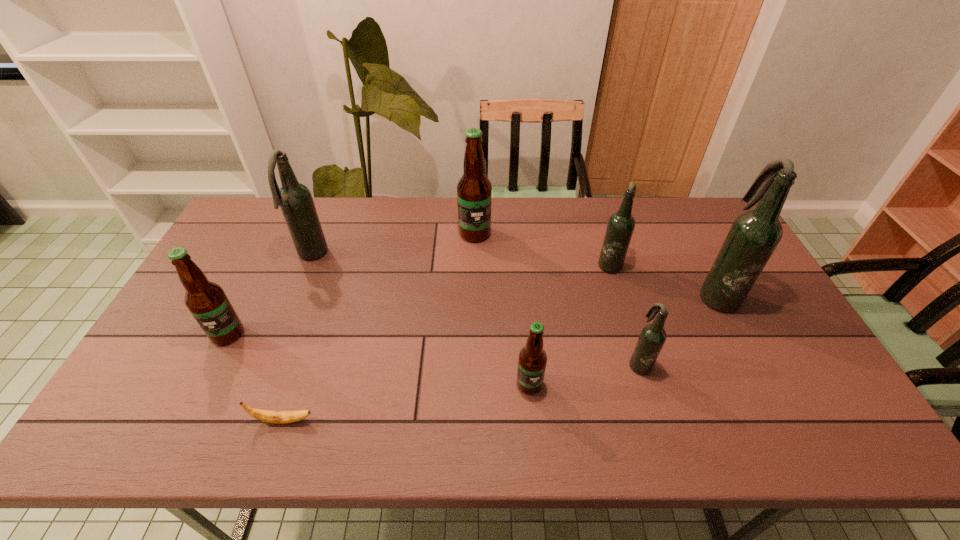
I want to click on the smallest brown beer bottle, so click(532, 360).

You are a GUI agent. You are given a task and a screenshot of the screen. Output one action in this format:
    pyautogui.click(x=<x>, y=<y>)
    Task: Click on the fifth object from left to right
    Image resolution: width=960 pixels, height=540 pixels.
    Given the screenshot: What is the action you would take?
    point(532,360)

This screenshot has width=960, height=540. I want to click on banana, so click(279, 417).

The height and width of the screenshot is (540, 960). In order to click on the nearest object in this screenshot , I will do `click(279, 417)`.

The image size is (960, 540). Find the location of `free space located 0.360m on the front of the rightmost object`. free space located 0.360m on the front of the rightmost object is located at coordinates (789, 436).

In order to click on free spot located on the left of the sixth beer bottle from right to left in this screenshot , I will do `click(273, 255)`.

Locate an element on the screen. The width and height of the screenshot is (960, 540). vacant space situated on the label of the fifth object from right to left is located at coordinates (474, 258).

Find the location of a particular element. The width and height of the screenshot is (960, 540). vacant space situated on the right of the third biggest dark beer bottle is located at coordinates (744, 264).

Locate an element on the screen. Image resolution: width=960 pixels, height=540 pixels. vacant space located 0.250m on the label of the leftmost beer bottle is located at coordinates pos(176,438).

Locate an element on the screen. Image resolution: width=960 pixels, height=540 pixels. vacant space located on the front of the nearest dark beer bottle is located at coordinates (660, 433).